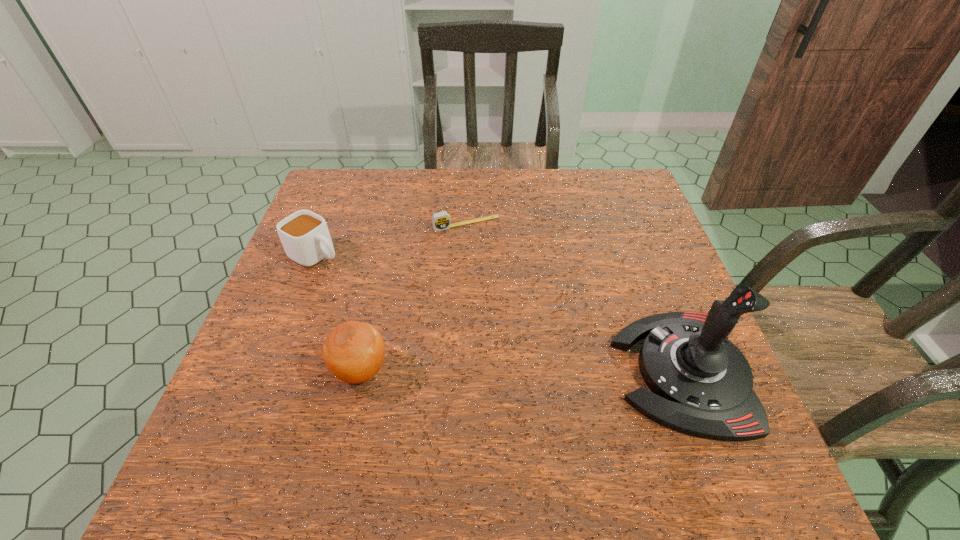
You are a GUI agent. You are given a task and a screenshot of the screen. Output one action in this format:
    pyautogui.click(x=<x>, y=<y>)
    Task: Click on the vacant space located 0.260m on the handle side of the joystick
    The image size is (960, 540).
    Given the screenshot: What is the action you would take?
    pyautogui.click(x=487, y=372)

Locate an element on the screen. free space located on the handle side of the joystick is located at coordinates (467, 372).

Locate an element on the screen. vacant space situated at the front of the farthest object with the tape extended is located at coordinates (516, 305).

Locate an element on the screen. The image size is (960, 540). vacant point located 0.060m at the front of the farthest object with the tape extended is located at coordinates (484, 246).

In order to click on vacant region located 0.310m at the front of the farthest object with the tape extended in this screenshot , I will do `click(520, 315)`.

This screenshot has width=960, height=540. Find the location of `free space located 0.130m on the side with the handle of the second farthest object`. free space located 0.130m on the side with the handle of the second farthest object is located at coordinates (374, 284).

Find the location of a particular element. The height and width of the screenshot is (540, 960). vacant space situated 0.080m on the side with the handle of the second farthest object is located at coordinates (359, 275).

Identify the location of vacant space located 0.320m on the side with the handle of the second farthest object. This screenshot has width=960, height=540. (437, 318).

Identify the location of orange that is at the near edge. The image size is (960, 540). (354, 351).

This screenshot has height=540, width=960. Identify the location of joystick present at the near edge. (701, 383).